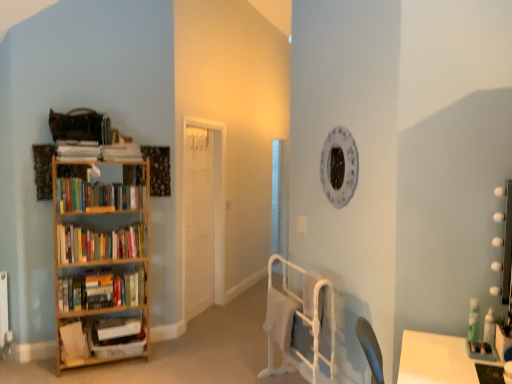
What do you see at coordinates (101, 338) in the screenshot?
I see `white plastic crate at lower left, which ranks as the 1th book in bottom-to-top order` at bounding box center [101, 338].

At what (x,y) coordinates should I click in order to perform the action: click on white plastic crate at lower left, arranged as the fifth book when viewed from the top. Please return your answer as a coordinate pair (x, y). Looking at the image, I should click on (101, 338).

The width and height of the screenshot is (512, 384). I want to click on hardcover books at left, which is counted as the 5th book, starting from the bottom, so click(97, 195).

The width and height of the screenshot is (512, 384). What do you see at coordinates (300, 322) in the screenshot?
I see `white metal bed frame at lower center` at bounding box center [300, 322].

The width and height of the screenshot is (512, 384). What are the coordinates of `wooden bookshelf at left` in the screenshot? It's located at (101, 268).

Which point is more forward, [123,230] or [95,306]?

The point [95,306] is in front.

How distant is wooden bookshelf at left, the 2th book viewed from the top, from wooden bookshelf at left, the third book viewed from the top?

wooden bookshelf at left, the 2th book viewed from the top, and wooden bookshelf at left, the third book viewed from the top, are 27.79 centimeters apart from each other.

Can you confirm if wooden bookshelf at left, arranged as the fourth book when ordered from the bottom, is wider than wooden bookshelf at left, the third book ordered from the bottom?

→ Incorrect, the width of wooden bookshelf at left, arranged as the fourth book when ordered from the bottom, does not surpass that of wooden bookshelf at left, the third book ordered from the bottom.

Can wooden bookshelf at left, the third book viewed from the top, be found inside wooden bookshelf at left, the 2th book viewed from the top?

That's incorrect, wooden bookshelf at left, the third book viewed from the top, is not inside wooden bookshelf at left, the 2th book viewed from the top.

From a real-world perspective, is white matte door at center above or below wooden bookshelf at left, the third book ordered from the bottom?

Clearly, from a real-world perspective, white matte door at center is above wooden bookshelf at left, the third book ordered from the bottom.

Can you tell me how much white matte door at center and wooden bookshelf at left, the third book viewed from the top, differ in facing direction?

47 degrees.

Considering the positions of point (187, 319) and point (72, 297), is point (187, 319) closer or farther from the camera than point (72, 297)?

Point (187, 319) is positioned farther from the camera compared to point (72, 297).

Is white matte door at center spatially inside wooden bookshelf at left, the third book viewed from the top, or outside of it?

white matte door at center exists outside the volume of wooden bookshelf at left, the third book viewed from the top.

Between hardcover books at left, which is counted as the first book, starting from the top, and white plastic crate at lower left, arranged as the fifth book when viewed from the top, which one has less height?

white plastic crate at lower left, arranged as the fifth book when viewed from the top.

Does hardcover books at left, which is counted as the first book, starting from the top, turn towards white plastic crate at lower left, which ranks as the 1th book in bottom-to-top order?

No, hardcover books at left, which is counted as the first book, starting from the top, does not turn towards white plastic crate at lower left, which ranks as the 1th book in bottom-to-top order.

Where is `the 3rd book to the left of the white plastic crate at lower left, which ranks as the 1th book in bottom-to-top order, counting from the anchor's position`? Image resolution: width=512 pixels, height=384 pixels. the 3rd book to the left of the white plastic crate at lower left, which ranks as the 1th book in bottom-to-top order, counting from the anchor's position is located at coordinates (97, 195).

Considering the sizes of objects hardcover books at left, which is counted as the first book, starting from the top, and white plastic crate at lower left, which ranks as the 1th book in bottom-to-top order, in the image provided, who is bigger, hardcover books at left, which is counted as the first book, starting from the top, or white plastic crate at lower left, which ranks as the 1th book in bottom-to-top order,?

Bigger between the two is hardcover books at left, which is counted as the first book, starting from the top.

Considering the points (144, 276) and (97, 344), which point is in front, point (144, 276) or point (97, 344)?

The point (97, 344) is in front.

Is wooden bookshelf at left beside white plastic crate at lower left, which ranks as the 1th book in bottom-to-top order?

wooden bookshelf at left is not next to white plastic crate at lower left, which ranks as the 1th book in bottom-to-top order, and they're not touching.

Where is `the 3rd book counting from the right side of the wooden bookshelf at left`? The image size is (512, 384). the 3rd book counting from the right side of the wooden bookshelf at left is located at coordinates (101, 338).

How much distance is there between wooden bookshelf at left and white plastic crate at lower left, arranged as the fifth book when viewed from the top?

wooden bookshelf at left is 10.56 inches away from white plastic crate at lower left, arranged as the fifth book when viewed from the top.

Does white matte door at center contain green plastic bottle at right?

No.

Based on the photo, considering the relative positions of white matte door at center and green plastic bottle at right in the image provided, is white matte door at center to the left of green plastic bottle at right from the viewer's perspective?

Correct, you'll find white matte door at center to the left of green plastic bottle at right.

Is white plastic crate at lower left, arranged as the fifth book when viewed from the top, taller than hardcover books at left, which is counted as the 5th book, starting from the bottom?

In fact, white plastic crate at lower left, arranged as the fifth book when viewed from the top, may be shorter than hardcover books at left, which is counted as the 5th book, starting from the bottom.

I want to click on the 2nd book behind the hardcover books at left, which is counted as the first book, starting from the top, so click(x=101, y=338).

Looking at this image, which is farther from the camera, [81,327] or [74,202]?

The point [74,202] is behind.

Is the position of white plastic crate at lower left, which ranks as the 1th book in bottom-to-top order, less distant than that of hardcover books at left, which is counted as the first book, starting from the top?

No, white plastic crate at lower left, which ranks as the 1th book in bottom-to-top order, is further to the viewer.

From the image's perspective, is white matte bookshelf at left, which ranks as the 2th book in bottom-to-top order, over wooden bookshelf at left, the 2th book viewed from the top?

No.

Is white matte bookshelf at left, which ranks as the 2th book in bottom-to-top order, turned away from wooden bookshelf at left, arranged as the fourth book when ordered from the bottom?

white matte bookshelf at left, which ranks as the 2th book in bottom-to-top order, is not turned away from wooden bookshelf at left, arranged as the fourth book when ordered from the bottom.

Is the position of white matte bookshelf at left, which ranks as the 2th book in bottom-to-top order, less distant than that of wooden bookshelf at left, the 2th book viewed from the top?

Yes, the depth of white matte bookshelf at left, which ranks as the 2th book in bottom-to-top order, is less than that of wooden bookshelf at left, the 2th book viewed from the top.

At what (x,y) coordinates should I click in order to perform the action: click on book that is the 1st object directly below the wooden bookshelf at left, arranged as the fourth book when ordered from the bottom (from a real-world perspective). Please return your answer as a coordinate pair (x, y). The width and height of the screenshot is (512, 384). Looking at the image, I should click on (101, 291).

Find the location of a particular element. door behind the wooden bookshelf at left, the third book ordered from the bottom is located at coordinates (199, 221).

Looking at the image, which one is located further to white matte bookshelf at left, marked as the fourth book in a top-to-bottom arrangement, wooden bookshelf at left, arranged as the fourth book when ordered from the bottom, or hardcover books at left, which is counted as the first book, starting from the top?

Among the two, hardcover books at left, which is counted as the first book, starting from the top, is located further to white matte bookshelf at left, marked as the fourth book in a top-to-bottom arrangement.

Which object lies nearer to the anchor point white metal bed frame at lower center, white matte door at center or hardcover books at left, which is counted as the first book, starting from the top?

Among the two, hardcover books at left, which is counted as the first book, starting from the top, is located nearer to white metal bed frame at lower center.

From the image, which object appears to be farther from wooden bookshelf at left, arranged as the fourth book when ordered from the bottom, white matte door at center or white metal bed frame at lower center?

white metal bed frame at lower center is further to wooden bookshelf at left, arranged as the fourth book when ordered from the bottom.

Based on their spatial positions, is wooden bookshelf at left, the third book viewed from the top, or green plastic bottle at right closer to wooden bookshelf at left?

Among the two, wooden bookshelf at left, the third book viewed from the top, is located nearer to wooden bookshelf at left.

Looking at the image, which one is located further to hardcover books at left, which is counted as the first book, starting from the top, white matte door at center or white plastic crate at lower left, which ranks as the 1th book in bottom-to-top order?

white matte door at center.

When comparing their distances from white matte door at center, does white matte bookshelf at left, marked as the fourth book in a top-to-bottom arrangement, or wooden bookshelf at left seem further?

Result: Among the two, white matte bookshelf at left, marked as the fourth book in a top-to-bottom arrangement, is located further to white matte door at center.

Which object lies nearer to the anchor point white matte bookshelf at left, marked as the fourth book in a top-to-bottom arrangement, white metal bed frame at lower center or wooden bookshelf at left, the third book ordered from the bottom?

wooden bookshelf at left, the third book ordered from the bottom, lies closer to white matte bookshelf at left, marked as the fourth book in a top-to-bottom arrangement, than the other object.

Estimate the real-world distances between objects in this image. Which object is further from white matte door at center, wooden bookshelf at left, the 2th book viewed from the top, or green plastic bottle at right?

The object further to white matte door at center is green plastic bottle at right.

The image size is (512, 384). I want to click on bed frame between green plastic bottle at right and white matte door at center in the front-back direction, so click(x=300, y=322).

The width and height of the screenshot is (512, 384). What are the coordinates of `book between wooden bookshelf at left, the third book ordered from the bottom, and white plastic crate at lower left, which ranks as the 1th book in bottom-to-top order, in the up-down direction` in the screenshot? It's located at pos(74,344).

Find the location of a particular element. This screenshot has width=512, height=384. shelf situated between hardcover books at left, which is counted as the 5th book, starting from the bottom, and white metal bed frame at lower center from left to right is located at coordinates (101, 268).

Locate an element on the screen. The width and height of the screenshot is (512, 384). bed frame located between white plastic crate at lower left, arranged as the fifth book when viewed from the top, and green plastic bottle at right in the left-right direction is located at coordinates (300, 322).